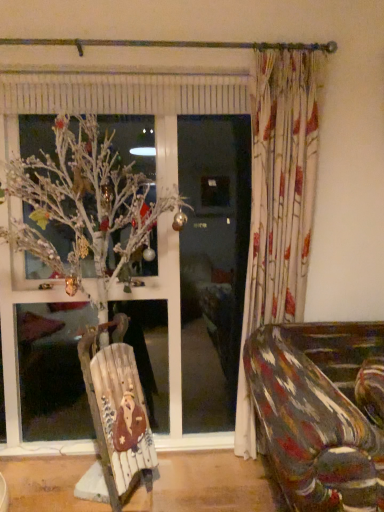
Find the location of a particular element. This screenshot has height=512, width=384. vacant area that is situated to the right of wooden sled at center is located at coordinates (183, 489).